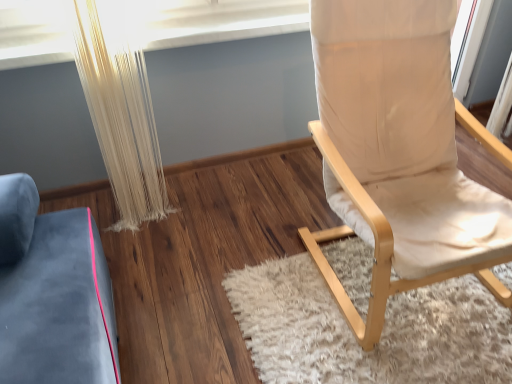
Question: Is white shaggy rug at center positioned beyond the bounds of white textured curtain at left?

Choices:
 (A) no
 (B) yes

Answer: (B)

Question: From the image's perspective, is white shaggy rug at center above white textured curtain at left?

Choices:
 (A) no
 (B) yes

Answer: (A)

Question: Considering the relative positions of white shaggy rug at center and white textured curtain at left in the image provided, is white shaggy rug at center to the right of white textured curtain at left from the viewer's perspective?

Choices:
 (A) yes
 (B) no

Answer: (A)

Question: Can you confirm if white shaggy rug at center is shorter than white textured curtain at left?

Choices:
 (A) no
 (B) yes

Answer: (B)

Question: Considering the relative positions of white shaggy rug at center and white textured curtain at left in the image provided, is white shaggy rug at center behind white textured curtain at left?

Choices:
 (A) no
 (B) yes

Answer: (A)

Question: Looking at the image, does white shaggy rug at center seem bigger or smaller compared to white textured curtain at left?

Choices:
 (A) big
 (B) small

Answer: (A)

Question: Is white shaggy rug at center taller or shorter than white textured curtain at left?

Choices:
 (A) tall
 (B) short

Answer: (B)

Question: Relative to white textured curtain at left, is white shaggy rug at center in front or behind?

Choices:
 (A) front
 (B) behind

Answer: (A)

Question: Is white shaggy rug at center wider or thinner than white textured curtain at left?

Choices:
 (A) thin
 (B) wide

Answer: (B)

Question: Is white textured curtain at left bigger or smaller than beige fabric chair at right?

Choices:
 (A) small
 (B) big

Answer: (A)

Question: In terms of width, does white textured curtain at left look wider or thinner when compared to beige fabric chair at right?

Choices:
 (A) thin
 (B) wide

Answer: (A)

Question: Considering the positions of white textured curtain at left and beige fabric chair at right in the image, is white textured curtain at left taller or shorter than beige fabric chair at right?

Choices:
 (A) tall
 (B) short

Answer: (B)

Question: Considering the positions of point (140, 168) and point (371, 286), is point (140, 168) closer or farther from the camera than point (371, 286)?

Choices:
 (A) farther
 (B) closer

Answer: (A)

Question: Does point (411, 69) appear closer or farther from the camera than point (128, 210)?

Choices:
 (A) closer
 (B) farther

Answer: (A)

Question: In terms of height, does beige fabric chair at right look taller or shorter compared to white textured curtain at left?

Choices:
 (A) tall
 (B) short

Answer: (A)